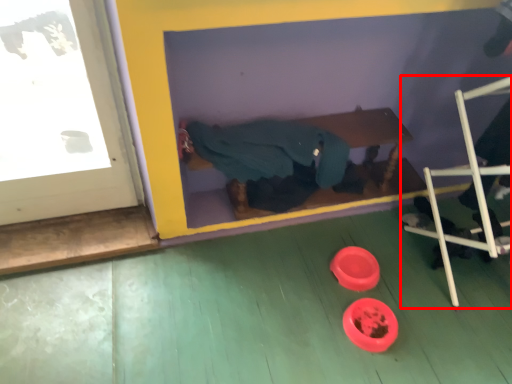
Question: Considering the relative positions of furniture (annotated by the red box) and person in the image provided, where is furniture (annotated by the red box) located with respect to the staircase?

Choices:
 (A) left
 (B) right

Answer: (B)